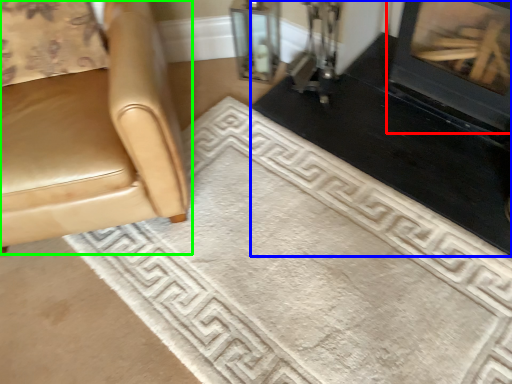
Question: Which is nearer to the fireplace (highlighted by a red box)? fireplace (highlighted by a blue box) or chair (highlighted by a green box).

Choices:
 (A) fireplace
 (B) chair

Answer: (A)